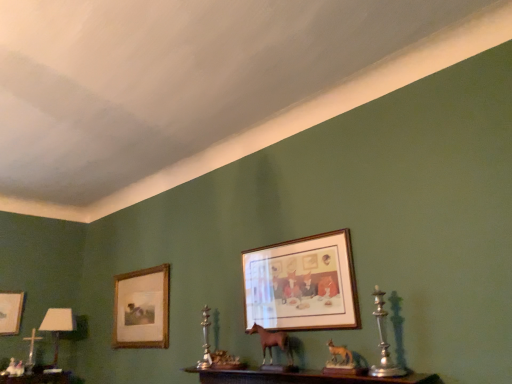
The image size is (512, 384). I want to click on wooden frame at center, the first picture frame from the front, so click(x=302, y=284).

You are a GUI agent. You are given a task and a screenshot of the screen. Output one action in this format:
    pyautogui.click(x=<x>, y=<y>)
    Task: Click on the silver metallic candle holder at center, the second candle holder from the front
    This screenshot has width=512, height=384.
    Given the screenshot: What is the action you would take?
    pyautogui.click(x=205, y=340)

In order to face matte gold picture frame at left, the 1th picture frame in the left-to-right sequence, should I rotate leftwards or rightwards?

You should look left and rotate roughly 31.819 degrees.

This screenshot has width=512, height=384. Describe the element at coordinates (11, 312) in the screenshot. I see `matte gold picture frame at left, which appears as the first picture frame when viewed from the back` at that location.

What do you see at coordinates (383, 342) in the screenshot? I see `silver metallic candle holder at right, the 2th candle holder in the bottom-to-top sequence` at bounding box center [383, 342].

The width and height of the screenshot is (512, 384). I want to click on wooden at center, so click(303, 377).

At what (x,y) coordinates should I click in order to perform the action: click on wooden frame at center, the first picture frame from the front. Please return your answer as a coordinate pair (x, y). The height and width of the screenshot is (384, 512). Looking at the image, I should click on (302, 284).

Which of these two, wooden picture frame at left, which ranks as the second picture frame in left-to-right order, or silver metallic candle holder at center, marked as the second candle holder in a right-to-left arrangement, stands shorter?

Standing shorter between the two is silver metallic candle holder at center, marked as the second candle holder in a right-to-left arrangement.

From the image's perspective, which picture frame is the 1st one below the silver metallic candle holder at center, placed as the 1th candle holder when sorted from bottom to top? Please provide its 2D coordinates.

[(142, 308)]

Is wooden picture frame at left, which ranks as the 2th picture frame in front-to-back order, oriented away from silver metallic candle holder at center, marked as the second candle holder in a right-to-left arrangement?

No, wooden picture frame at left, which ranks as the 2th picture frame in front-to-back order,'s orientation is not away from silver metallic candle holder at center, marked as the second candle holder in a right-to-left arrangement.

From a real-world perspective, which object rests below the other?

silver metallic candle holder at center, the second candle holder from the front.

What's the angular difference between white glossy table lamp at lower left and matte gold picture frame at left, which is the 3th picture frame in right-to-left order,'s facing directions?

36 degrees.

Is white glossy table lamp at lower left far from matte gold picture frame at left, the 1th picture frame in the left-to-right sequence?

No.

The width and height of the screenshot is (512, 384). In order to click on the 2nd picture frame positioned above the white glossy table lamp at lower left (from a real-world perspective) in this screenshot , I will do `click(11, 312)`.

From the image's perspective, which is below, white glossy table lamp at lower left or matte gold picture frame at left, positioned as the third picture frame in front-to-back order?

white glossy table lamp at lower left appears lower in the image.

Can we say silver metallic candle holder at right, the 2th candle holder in the bottom-to-top sequence, lies outside matte gold picture frame at left, which is the 3th picture frame in right-to-left order?

silver metallic candle holder at right, the 2th candle holder in the bottom-to-top sequence, is positioned outside matte gold picture frame at left, which is the 3th picture frame in right-to-left order.

Considering the relative positions of silver metallic candle holder at right, arranged as the 1th candle holder when viewed from the front, and matte gold picture frame at left, which is the 3th picture frame in right-to-left order, in the image provided, is silver metallic candle holder at right, arranged as the 1th candle holder when viewed from the front, to the left or to the right of matte gold picture frame at left, which is the 3th picture frame in right-to-left order,?

Clearly, silver metallic candle holder at right, arranged as the 1th candle holder when viewed from the front, is on the right of matte gold picture frame at left, which is the 3th picture frame in right-to-left order, in the image.

Is silver metallic candle holder at right, the 2th candle holder in the bottom-to-top sequence, facing towards matte gold picture frame at left, the 1th picture frame in the left-to-right sequence?

No, silver metallic candle holder at right, the 2th candle holder in the bottom-to-top sequence, is not oriented towards matte gold picture frame at left, the 1th picture frame in the left-to-right sequence.

Which object is further away from the camera, silver metallic candle holder at right, which is the first candle holder from top to bottom, or matte gold picture frame at left, which is the 3th picture frame in right-to-left order?

matte gold picture frame at left, which is the 3th picture frame in right-to-left order, is further away from the camera.

Is brown matte horse at center inside the boundaries of silver metallic candle holder at center, which ranks as the first candle holder in left-to-right order, or outside?

brown matte horse at center is outside silver metallic candle holder at center, which ranks as the first candle holder in left-to-right order.

From the image's perspective, is brown matte horse at center located above silver metallic candle holder at center, placed as the 1th candle holder when sorted from bottom to top?

Yes, from the image's perspective, brown matte horse at center is above silver metallic candle holder at center, placed as the 1th candle holder when sorted from bottom to top.

Is brown matte horse at center bigger than silver metallic candle holder at center, marked as the 2th candle holder in a top-to-bottom arrangement?

No.

Is point (279, 343) closer to viewer compared to point (202, 361)?

Yes, point (279, 343) is closer to viewer.

From the image's perspective, which one is positioned lower, white glossy table lamp at lower left or brown matte horse at center?

white glossy table lamp at lower left appears lower in the image.

Which is in front, point (57, 332) or point (278, 332)?

The point (278, 332) is closer.

How many degrees apart are the facing directions of white glossy table lamp at lower left and brown matte horse at center?

white glossy table lamp at lower left and brown matte horse at center are facing 54.7 degrees away from each other.

How far apart are white glossy table lamp at lower left and brown matte horse at center?

They are 2.03 meters apart.

Based on the photo, what's the angular difference between brown matte horse at center and wooden at center's facing directions?

0.407 degrees separate the facing orientations of brown matte horse at center and wooden at center.

Does brown matte horse at center have a smaller size compared to wooden at center?

Correct, brown matte horse at center occupies less space than wooden at center.

Which object is more forward, brown matte horse at center or wooden at center?

wooden at center is closer to the camera.

Does brown matte horse at center have a lesser width compared to wooden at center?

Yes.

Can you confirm if white glossy table lamp at lower left is wider than wooden frame at center, which appears as the 3th picture frame when viewed from the left?

Yes.

Which is nearer, (56, 314) or (268, 317)?

Point (56, 314) appears to be farther away from the viewer than point (268, 317).

In the scene shown: In terms of size, does white glossy table lamp at lower left appear bigger or smaller than wooden frame at center, which appears as the 3th picture frame when viewed from the left?

white glossy table lamp at lower left is bigger than wooden frame at center, which appears as the 3th picture frame when viewed from the left.

Is white glossy table lamp at lower left next to wooden frame at center, the first picture frame from the front, and touching it?

No.

Locate an element on the screen. picture frame that is the 1st one when counting leftward from the silver metallic candle holder at center, which is counted as the 1th candle holder, starting from the back is located at coordinates (142, 308).

The height and width of the screenshot is (384, 512). In the image, there is a matte gold picture frame at left, the 1th picture frame in the left-to-right sequence. What are the coordinates of `table lamp below it (from a real-world perspective)` in the screenshot? It's located at (58, 326).

Considering their positions, is white glossy table lamp at lower left positioned further to wooden frame at center, the first picture frame from the front, than wooden at center?

white glossy table lamp at lower left lies further to wooden frame at center, the first picture frame from the front, than the other object.

Based on the photo, from the image, which object appears to be farther from wooden at center, silver metallic candle holder at center, marked as the second candle holder in a right-to-left arrangement, or white glossy table lamp at lower left?

white glossy table lamp at lower left is positioned further to the anchor wooden at center.

Which object lies nearer to the anchor point wooden at center, matte gold picture frame at left, the 1th picture frame in the left-to-right sequence, or silver metallic candle holder at center, marked as the 2th candle holder in a top-to-bottom arrangement?

The object closer to wooden at center is silver metallic candle holder at center, marked as the 2th candle holder in a top-to-bottom arrangement.

Based on their spatial positions, is silver metallic candle holder at right, the 2th candle holder in the bottom-to-top sequence, or white glossy table lamp at lower left closer to wooden at center?

silver metallic candle holder at right, the 2th candle holder in the bottom-to-top sequence.

When comparing their distances from silver metallic candle holder at center, the second candle holder from the front, does matte gold picture frame at left, the 1th picture frame in the left-to-right sequence, or brown matte horse at center seem closer?

Based on the image, brown matte horse at center appears to be nearer to silver metallic candle holder at center, the second candle holder from the front.

Estimate the real-world distances between objects in this image. Which object is further from wooden at center, silver metallic candle holder at center, the second candle holder from the front, or wooden frame at center, the first picture frame positioned from the right?

silver metallic candle holder at center, the second candle holder from the front, lies further to wooden at center than the other object.

When comparing their distances from matte gold picture frame at left, the 1th picture frame in the left-to-right sequence, does wooden at center or wooden frame at center, the first picture frame from the front, seem closer?

wooden at center lies closer to matte gold picture frame at left, the 1th picture frame in the left-to-right sequence, than the other object.

From the image, which object appears to be nearer to silver metallic candle holder at right, the 2th candle holder in the bottom-to-top sequence, brown matte horse at center or wooden frame at center, the first picture frame positioned from the right?

wooden frame at center, the first picture frame positioned from the right, lies closer to silver metallic candle holder at right, the 2th candle holder in the bottom-to-top sequence, than the other object.

The height and width of the screenshot is (384, 512). I want to click on table lamp located between matte gold picture frame at left, positioned as the third picture frame in front-to-back order, and silver metallic candle holder at right, the 1th candle holder from the right, in the left-right direction, so click(x=58, y=326).

Find the location of `animal between white glossy table lamp at lower left and silver metallic candle holder at right, which is counted as the second candle holder, starting from the back, in the horizontal direction`. animal between white glossy table lamp at lower left and silver metallic candle holder at right, which is counted as the second candle holder, starting from the back, in the horizontal direction is located at coordinates (273, 344).

Find the location of a particular element. This screenshot has height=384, width=512. picture frame situated between matte gold picture frame at left, positioned as the third picture frame in front-to-back order, and brown matte horse at center from left to right is located at coordinates (142, 308).

Identify the location of animal positioned between wooden at center and wooden picture frame at left, which ranks as the 2th picture frame in right-to-left order, from near to far. This screenshot has height=384, width=512. (273, 344).